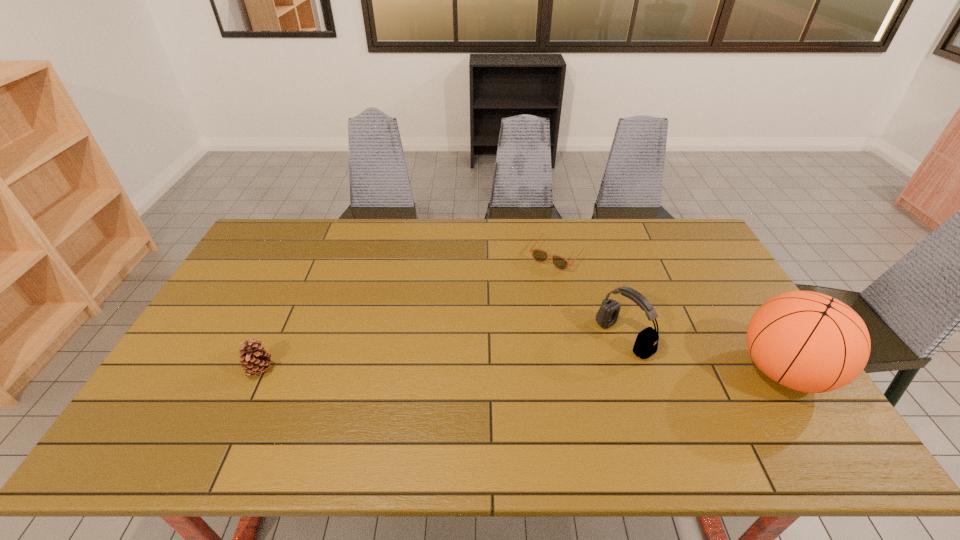
At what (x,y) coordinates should I click in order to perform the action: click on the leftmost object. Please return your answer as a coordinate pair (x, y). Looking at the image, I should click on (255, 359).

Where is `pinecone`? This screenshot has height=540, width=960. pinecone is located at coordinates (255, 359).

At what (x,y) coordinates should I click in order to perform the action: click on the tallest object. Please return your answer as a coordinate pair (x, y). Looking at the image, I should click on (807, 341).

The width and height of the screenshot is (960, 540). Find the location of `the rightmost object`. the rightmost object is located at coordinates pos(807,341).

At what (x,y) coordinates should I click in order to perform the action: click on the second tallest object. Please return your answer as a coordinate pair (x, y). Looking at the image, I should click on (646, 344).

What are the coordinates of `the shortest object` in the screenshot? It's located at (539, 255).

Find the location of a particular element. sunglasses is located at coordinates (539, 255).

Locate an element on the screen. free spot located 0.120m on the left of the third tallest object is located at coordinates (202, 370).

Where is `vacant space located on the back of the rightmost object`? vacant space located on the back of the rightmost object is located at coordinates (709, 253).

Identify the location of vacant space located 0.110m on the headband of the headset. The height and width of the screenshot is (540, 960). (578, 370).